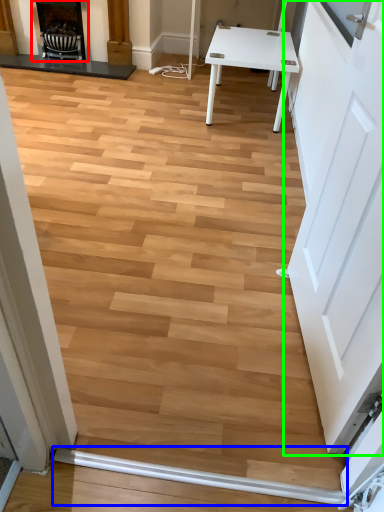
Question: Which is nearer to the fireplace (highlighted by a red box)? beam (highlighted by a blue box) or door (highlighted by a green box).

Choices:
 (A) beam
 (B) door

Answer: (B)